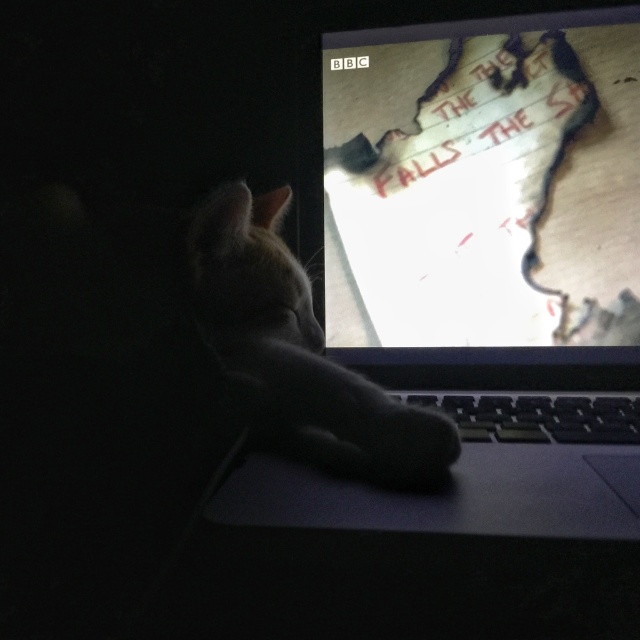
Does slate gray laptop at center appear under black fuzzy paw at lower center?

Incorrect, slate gray laptop at center is not positioned below black fuzzy paw at lower center.

Consider the image. Does slate gray laptop at center appear over black fuzzy paw at lower center?

Correct, slate gray laptop at center is located above black fuzzy paw at lower center.

Find the location of a particular element. The image size is (640, 640). slate gray laptop at center is located at coordinates (483, 273).

Is white paper at center closer to the viewer compared to white fur cat at center?

No, it is not.

Is point (445, 228) positioned behind point (230, 246)?

Yes, it is behind point (230, 246).

Which is behind, point (499, 280) or point (404, 424)?

The point (499, 280) is behind.

At what (x,y) coordinates should I click in order to perform the action: click on white paper at center. Please return your answer as a coordinate pair (x, y). Image resolution: width=640 pixels, height=640 pixels. Looking at the image, I should click on (483, 182).

Is slate gray laptop at center above black plastic keyboard at center?

Yes.

Who is more forward, (356, 227) or (554, 412)?

Point (554, 412)

This screenshot has width=640, height=640. I want to click on slate gray laptop at center, so click(483, 273).